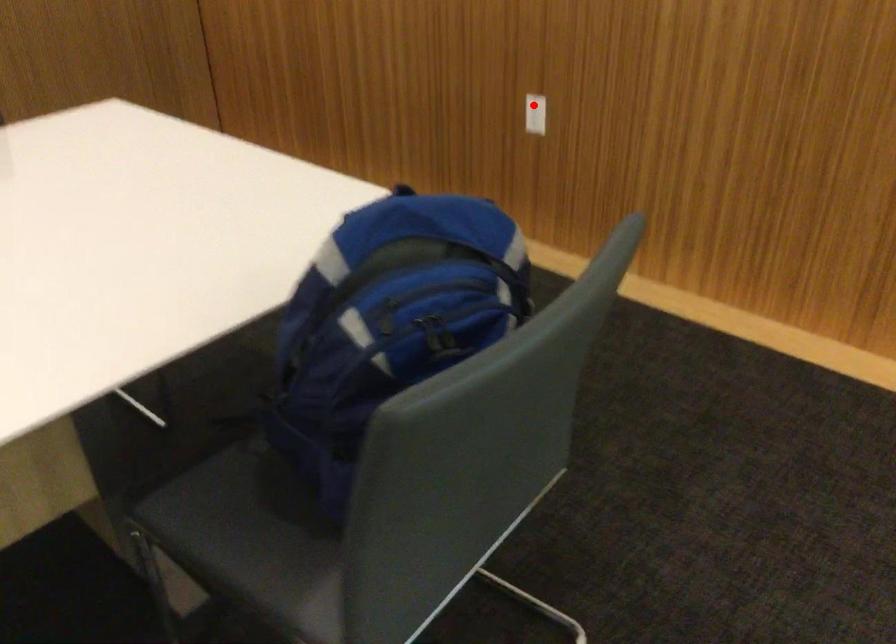
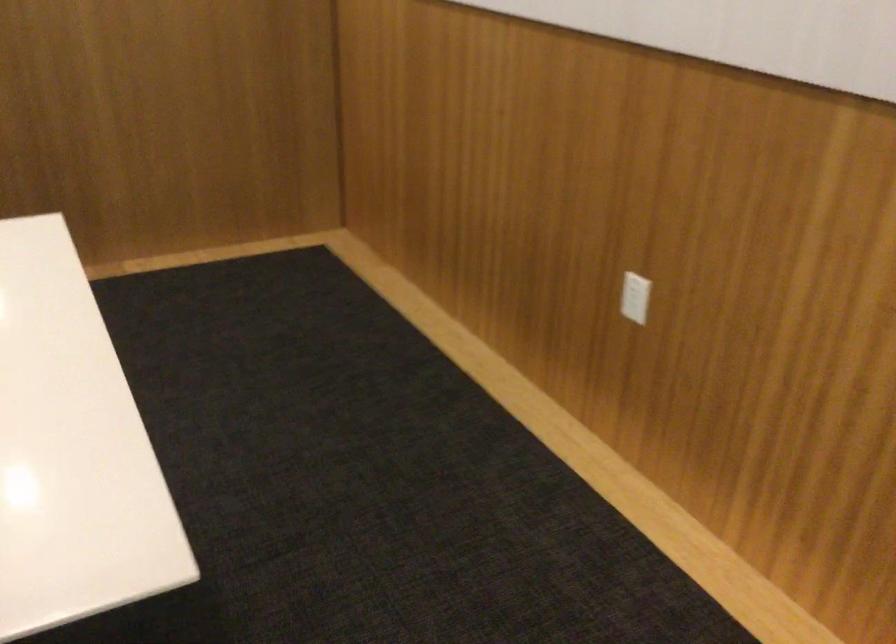
Question: I am providing you with two images of the same scene from different viewpoints. A red point is shown in image1. For the corresponding object point in image2, is it positioned nearer or farther from the camera?

Choices:
 (A) Nearer
 (B) Farther

Answer: (A)